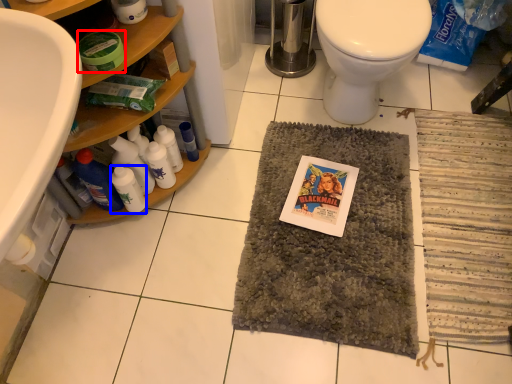
Question: Which of the following is the farthest to the observer, product (highlighted by a red box) or bottle (highlighted by a blue box)?

Choices:
 (A) product
 (B) bottle

Answer: (B)